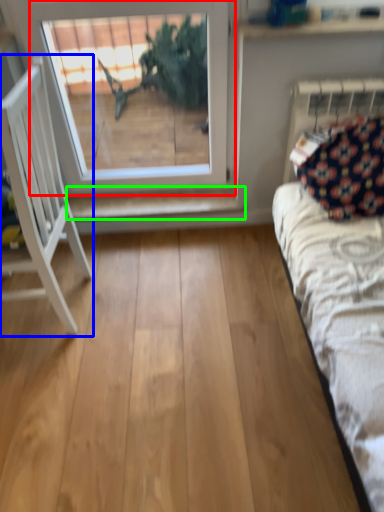
Question: Which is farther away from window (highlighted by a red box)? furniture (highlighted by a blue box) or shelf (highlighted by a green box)?

Choices:
 (A) furniture
 (B) shelf

Answer: (A)